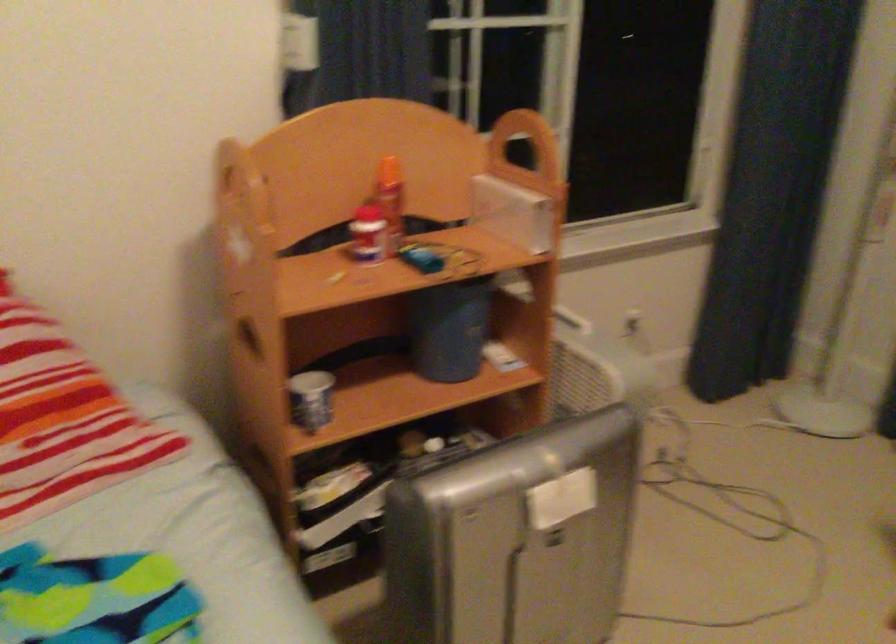
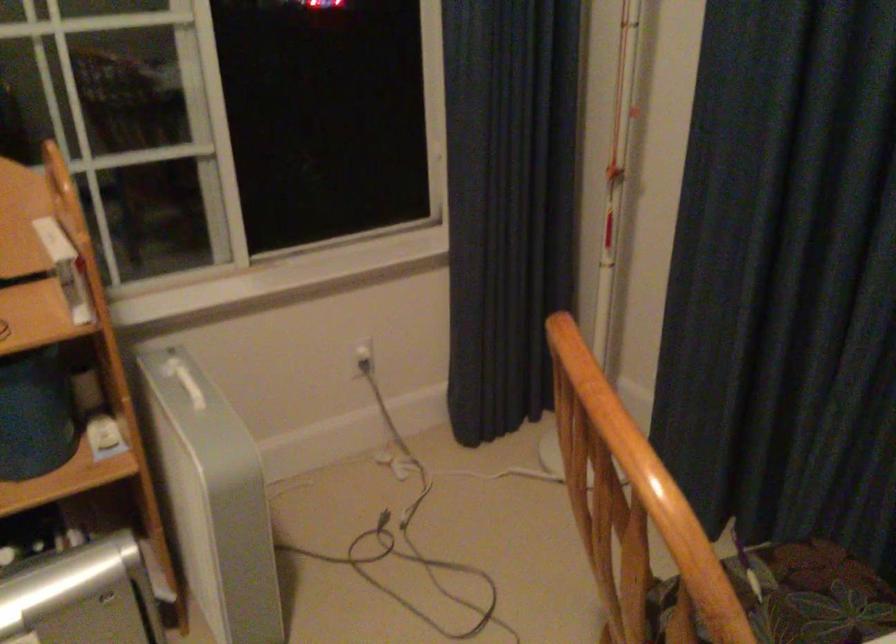
Locate, in the second image, the point that corresponds to the point at 645,310 in the first image.

(363, 355)